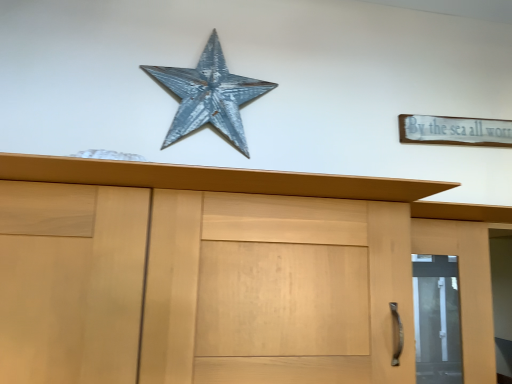
Question: Is the surface of white wood sign at upper right in direct contact with matte wood door at right?

Choices:
 (A) no
 (B) yes

Answer: (A)

Question: Does white wood sign at upper right have a lesser height compared to matte wood door at right?

Choices:
 (A) yes
 (B) no

Answer: (A)

Question: Can you confirm if white wood sign at upper right is smaller than matte wood door at right?

Choices:
 (A) yes
 (B) no

Answer: (A)

Question: Does white wood sign at upper right come behind matte wood door at right?

Choices:
 (A) yes
 (B) no

Answer: (A)

Question: Can you confirm if white wood sign at upper right is positioned to the right of matte wood door at right?

Choices:
 (A) yes
 (B) no

Answer: (B)

Question: From a real-world perspective, relative to matte wood door at right, is rusty metal star at upper center vertically above or below?

Choices:
 (A) below
 (B) above

Answer: (B)

Question: Is rusty metal star at upper center in front of or behind matte wood door at right in the image?

Choices:
 (A) front
 (B) behind

Answer: (B)

Question: In terms of size, does rusty metal star at upper center appear bigger or smaller than matte wood door at right?

Choices:
 (A) big
 (B) small

Answer: (B)

Question: Is rusty metal star at upper center wider or thinner than matte wood door at right?

Choices:
 (A) wide
 (B) thin

Answer: (B)

Question: Is matte wood door at right spatially inside white wood sign at upper right, or outside of it?

Choices:
 (A) inside
 (B) outside

Answer: (B)

Question: Is matte wood door at right taller or shorter than white wood sign at upper right?

Choices:
 (A) short
 (B) tall

Answer: (B)

Question: In the image, is matte wood door at right positioned in front of or behind white wood sign at upper right?

Choices:
 (A) front
 (B) behind

Answer: (A)

Question: Is point (480, 276) positioned closer to the camera than point (450, 142)?

Choices:
 (A) farther
 (B) closer

Answer: (B)

Question: Is white wood sign at upper right bigger or smaller than rusty metal star at upper center?

Choices:
 (A) small
 (B) big

Answer: (A)

Question: From a real-world perspective, is white wood sign at upper right above or below rusty metal star at upper center?

Choices:
 (A) below
 (B) above

Answer: (A)